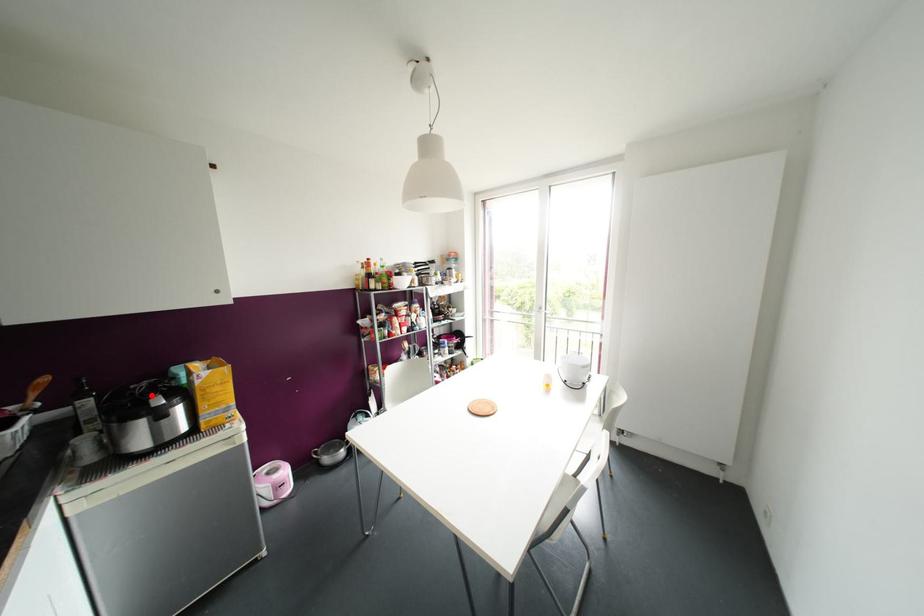
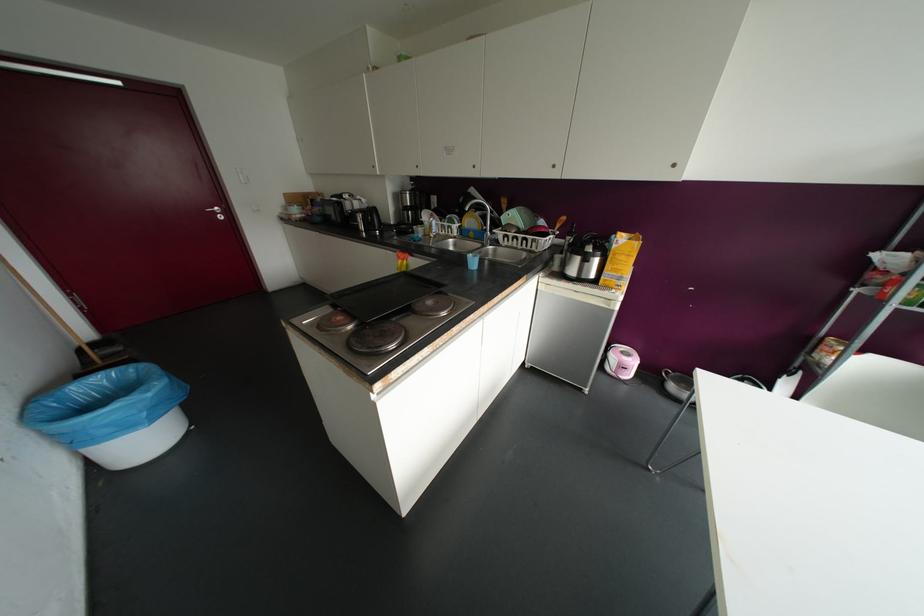
Question: I am providing you with two images of the same scene from different viewpoints. A red point is marked on the first image. Is the red point's position out of view in image 2?

Choices:
 (A) Yes
 (B) No

Answer: (B)